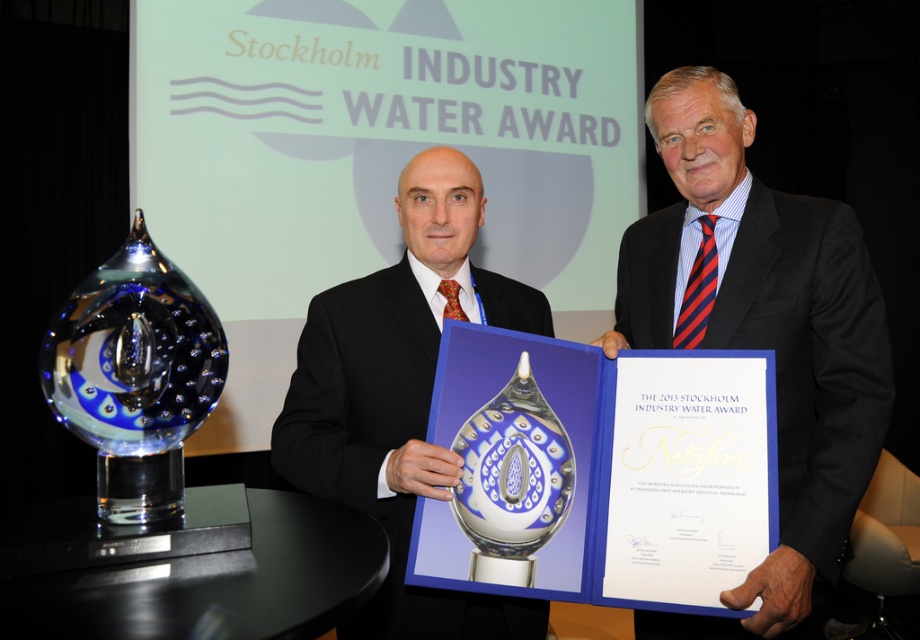
Question: Which object is closer to the camera taking this photo?

Choices:
 (A) blue glass award at center
 (B) blue glass trophy at left
 (C) matte black suit at center

Answer: (B)

Question: Which object appears farthest from the camera in this image?

Choices:
 (A) transparent glass trophy at center
 (B) blue glass award at center
 (C) matte black suit at center

Answer: (C)

Question: Does blue glass trophy at left lie behind transparent glass trophy at center?

Choices:
 (A) yes
 (B) no

Answer: (B)

Question: Among these objects, which one is farthest from the camera?

Choices:
 (A) matte black suit at center
 (B) blue glass trophy at left
 (C) blue glass award at center
 (D) transparent glass trophy at center

Answer: (A)

Question: Is blue glass award at center further to the viewer compared to blue glass trophy at left?

Choices:
 (A) no
 (B) yes

Answer: (B)

Question: Is blue glass award at center to the right of transparent glass trophy at center from the viewer's perspective?

Choices:
 (A) no
 (B) yes

Answer: (B)